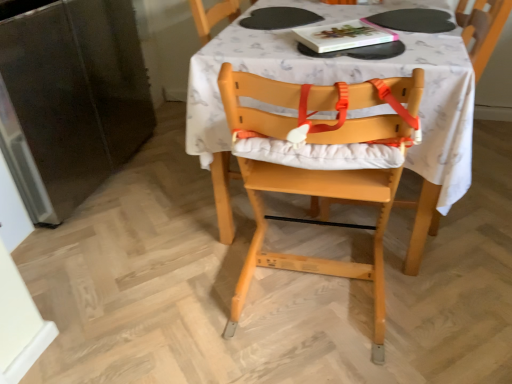
Question: From the image's perspective, is hardcover book at upper center on top of white fabric table at center?

Choices:
 (A) no
 (B) yes

Answer: (B)

Question: Is hardcover book at upper center smaller than white fabric table at center?

Choices:
 (A) no
 (B) yes

Answer: (B)

Question: From a real-world perspective, is hardcover book at upper center on top of white fabric table at center?

Choices:
 (A) yes
 (B) no

Answer: (A)

Question: Is hardcover book at upper center next to white fabric table at center?

Choices:
 (A) no
 (B) yes

Answer: (A)

Question: Is hardcover book at upper center shorter than white fabric table at center?

Choices:
 (A) no
 (B) yes

Answer: (B)

Question: Is hardcover book at upper center bigger than white fabric table at center?

Choices:
 (A) no
 (B) yes

Answer: (A)

Question: From the image's perspective, would you say white fabric table at center is shown under hardcover book at upper center?

Choices:
 (A) yes
 (B) no

Answer: (A)

Question: Is white fabric table at center wider than hardcover book at upper center?

Choices:
 (A) no
 (B) yes

Answer: (B)

Question: Is white fabric table at center positioned in front of hardcover book at upper center?

Choices:
 (A) no
 (B) yes

Answer: (B)

Question: Is white fabric table at center located outside hardcover book at upper center?

Choices:
 (A) yes
 (B) no

Answer: (A)

Question: Could you tell me if white fabric table at center is facing hardcover book at upper center?

Choices:
 (A) yes
 (B) no

Answer: (B)

Question: From a real-world perspective, is white fabric table at center on top of hardcover book at upper center?

Choices:
 (A) yes
 (B) no

Answer: (B)

Question: Is white fabric table at center facing away from natural wood highchair at center?

Choices:
 (A) no
 (B) yes

Answer: (A)